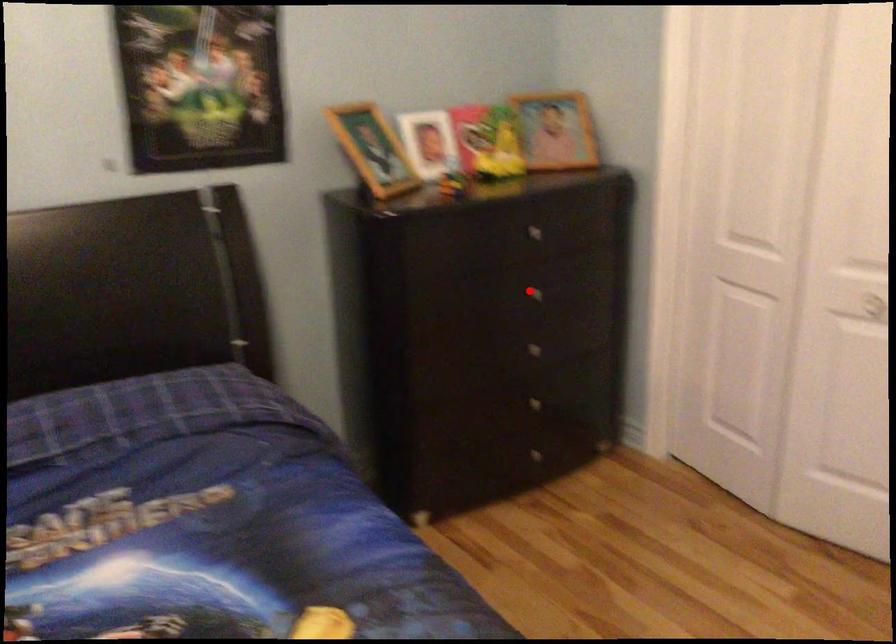
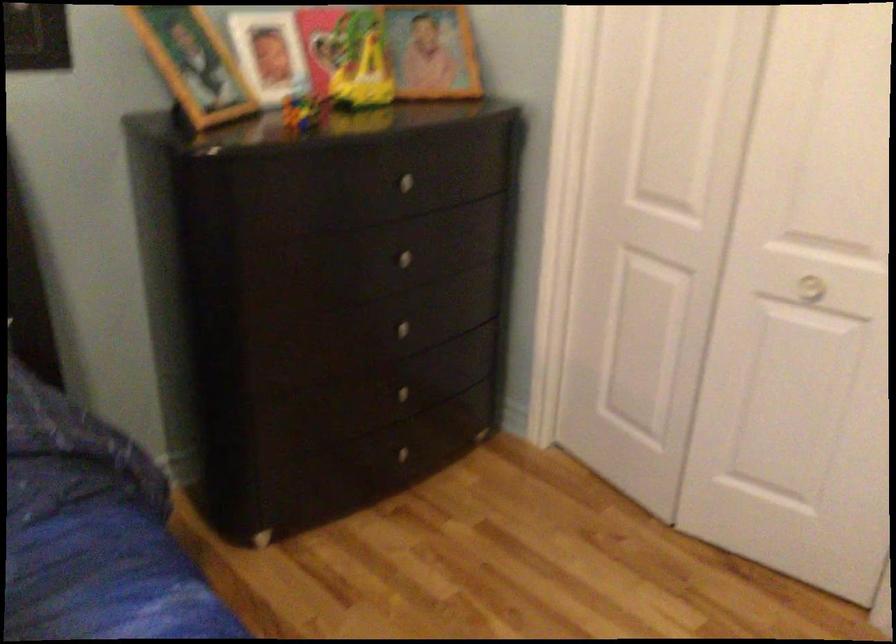
In the second image, find the point that corresponds to the highlighted location in the first image.

(399, 258)